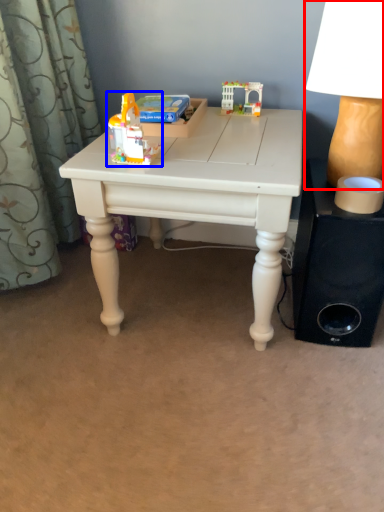
Question: Which object is closer to the camera taking this photo, table lamp (highlighted by a red box) or toy (highlighted by a blue box)?

Choices:
 (A) table lamp
 (B) toy

Answer: (A)